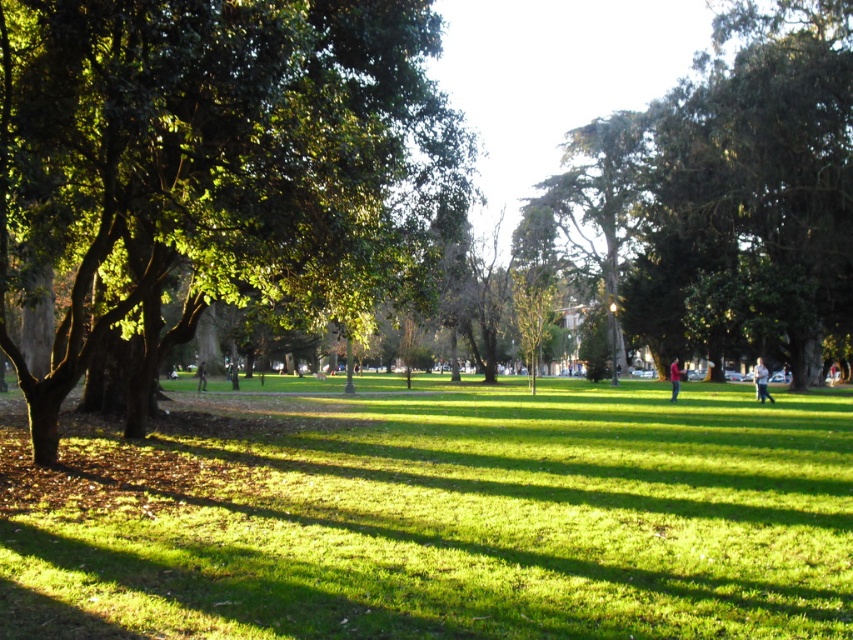
Can you confirm if green grassy at center is wider than light brown wooden bench at center?

Indeed, green grassy at center has a greater width compared to light brown wooden bench at center.

Is green grassy at center further to camera compared to light brown wooden bench at center?

No, green grassy at center is closer to the viewer.

Is point (177, 497) more distant than point (234, 388)?

That is False.

Locate an element on the screen. The height and width of the screenshot is (640, 853). green grassy at center is located at coordinates (436, 513).

Measure the distance between green grassy at center and red matte jacket at center.

green grassy at center is 14.81 meters away from red matte jacket at center.

Between green grassy at center and red matte jacket at center, which one appears on the right side from the viewer's perspective?

From the viewer's perspective, red matte jacket at center appears more on the right side.

The width and height of the screenshot is (853, 640). What are the coordinates of `green grassy at center` in the screenshot? It's located at (436, 513).

In the scene shown: Which of these two, green leafy tree at center or light brown leather jacket at center, stands taller?

With more height is green leafy tree at center.

Can you confirm if green leafy tree at center is taller than light brown leather jacket at center?

Indeed, green leafy tree at center has a greater height compared to light brown leather jacket at center.

Is point (175, 115) farther from camera compared to point (196, 369)?

No.

You are a GUI agent. You are given a task and a screenshot of the screen. Output one action in this format:
    pyautogui.click(x=<x>, y=<y>)
    Task: Click on the green leafy tree at center
    
    Given the screenshot: What is the action you would take?
    pyautogui.click(x=215, y=172)